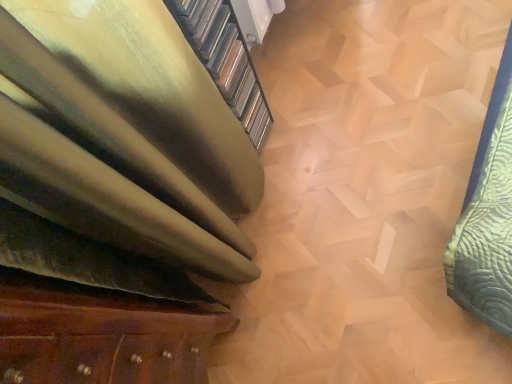
This screenshot has height=384, width=512. I want to click on unoccupied region to the right of wooden drawer at lower left, so click(x=278, y=299).